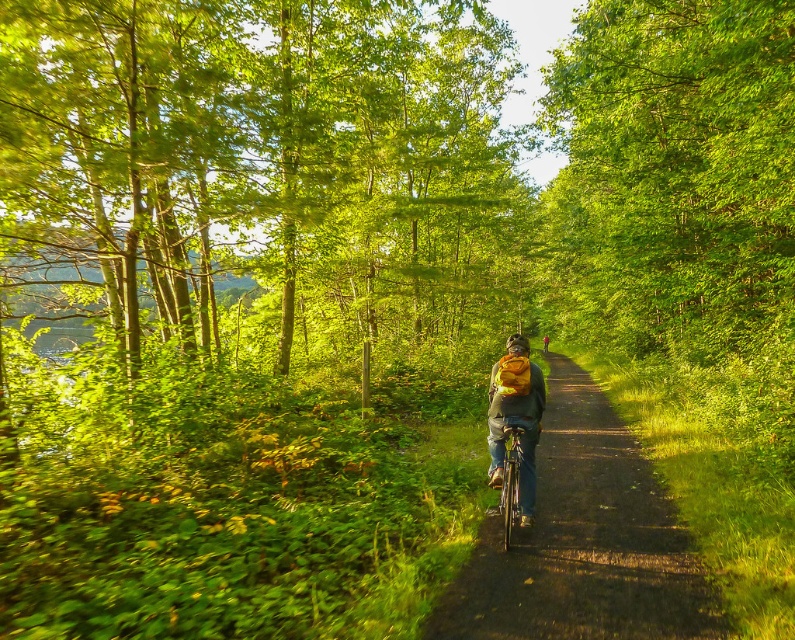
Identify the location of smooth asphalt path at center. The image size is (795, 640). pyautogui.click(x=584, y=541).

Is point (669, 556) positioned before point (507, 547)?

Yes, point (669, 556) is closer to viewer.

At what (x,y) coordinates should I click in order to perform the action: click on smooth asphalt path at center. Please return your answer as a coordinate pair (x, y). Image resolution: width=795 pixels, height=640 pixels. Looking at the image, I should click on (584, 541).

Who is more distant from viewer, (425, 291) or (644, 518)?

Point (425, 291)

Does point (284, 76) come behind point (611, 564)?

That is True.

You are a GUI agent. You are given a task and a screenshot of the screen. Output one action in this format:
    pyautogui.click(x=<x>, y=<y>)
    Task: Click on the green leafy tree at center
    The height and width of the screenshot is (640, 795).
    Given the screenshot: What is the action you would take?
    pyautogui.click(x=262, y=172)

Is green leafy tree at center wider than shiny metallic bicycle at center?

Correct, the width of green leafy tree at center exceeds that of shiny metallic bicycle at center.

Between point (342, 60) and point (520, 436), which one is positioned in front?

Point (520, 436) is more forward.

Does point (293, 61) lie in front of point (526, 518)?

No, it is behind (526, 518).

Locate an element on the screen. This screenshot has width=795, height=640. green leafy tree at center is located at coordinates (262, 172).